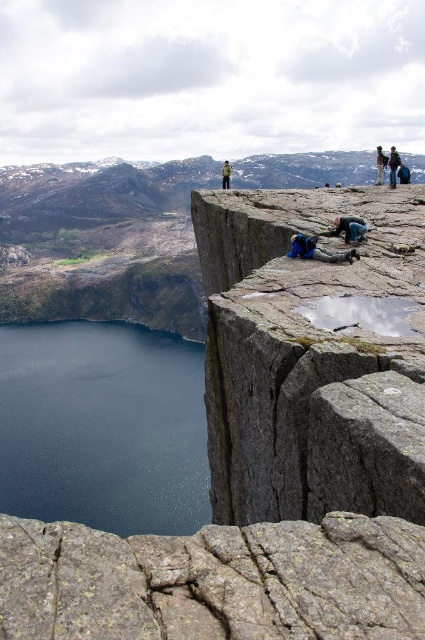
Can you confirm if gray rough rock at lower center is positioned above dark blue water at lower left?

Correct, gray rough rock at lower center is located above dark blue water at lower left.

Who is more forward, (303, 621) or (187, 528)?

Positioned in front is point (303, 621).

Where is `gray rough rock at lower center`? Image resolution: width=425 pixels, height=640 pixels. gray rough rock at lower center is located at coordinates (215, 580).

Who is lower down, dark blue water at lower left or green fabric jacket at center?

dark blue water at lower left is lower down.

Who is more distant from viewer, (14, 387) or (226, 180)?

The point (14, 387) is behind.

Find the location of a particular element. The height and width of the screenshot is (640, 425). dark blue water at lower left is located at coordinates (102, 426).

Does gray rough rock at center have a greater width compared to dark blue water at lower left?

No, gray rough rock at center is not wider than dark blue water at lower left.

Can you confirm if gray rough rock at center is thinner than dark blue water at lower left?

Indeed, gray rough rock at center has a lesser width compared to dark blue water at lower left.

Is point (320, 220) farther from viewer compared to point (197, 355)?

That is False.

The width and height of the screenshot is (425, 640). Find the location of `gray rough rock at center`. gray rough rock at center is located at coordinates (312, 356).